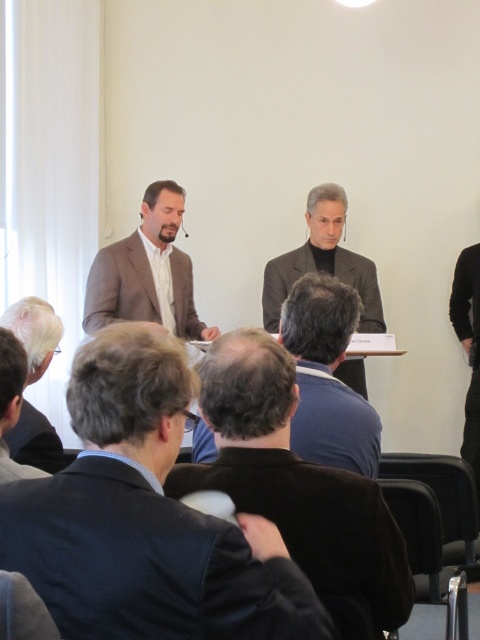
Identify the location of black velvet jacket at center. (298, 486).

Image resolution: width=480 pixels, height=640 pixels. Find the location of `black velvet jacket at center`. black velvet jacket at center is located at coordinates (298, 486).

This screenshot has height=640, width=480. I want to click on black velvet jacket at center, so click(x=298, y=486).

Which is more to the left, dark brown suit at lower left or black fabric jacket at right?

dark brown suit at lower left

At what (x,y) coordinates should I click in order to perform the action: click on dark brown suit at lower left. Please return your answer as a coordinate pair (x, y). This screenshot has width=480, height=640. Looking at the image, I should click on (144, 516).

Image resolution: width=480 pixels, height=640 pixels. I want to click on dark brown suit at lower left, so click(x=144, y=516).

Can you confirm if dark brown suit at lower left is positioned to the left of dark gray wool suit at lower left?

In fact, dark brown suit at lower left is to the right of dark gray wool suit at lower left.

Is point (172, 525) positioned in front of point (36, 461)?

Yes, point (172, 525) is in front of point (36, 461).

Find the location of a particular element. dark brown suit at lower left is located at coordinates (144, 516).